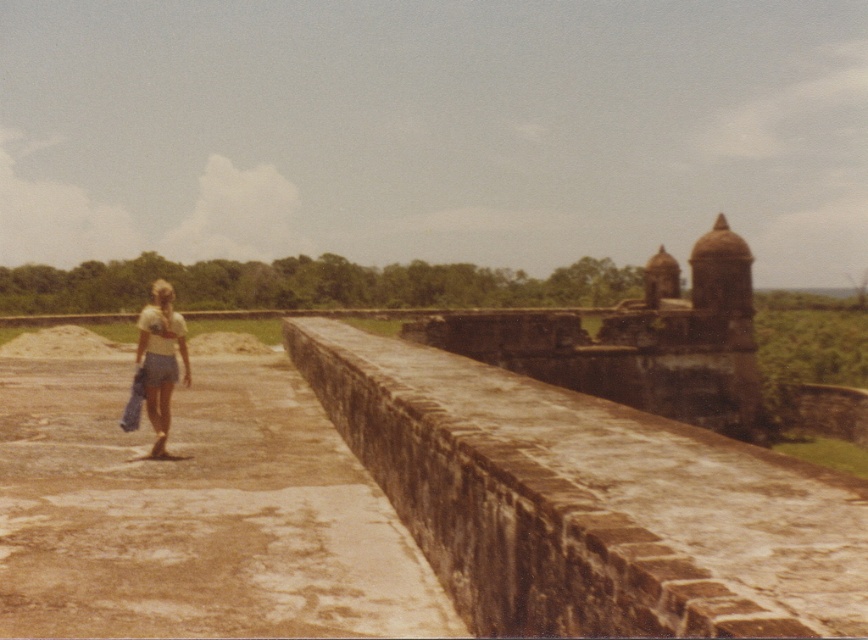
You are standing at the entrance of the historical site and notice a brown stone fort at center and a white cotton shirt at center. Which object is positioned lower in the image?

The brown stone fort at center is located below the white cotton shirt at center, so it is positioned lower in the image.

You are standing at the entrance of the fortress and see the brown stone moat at center and the white cotton shirt at center. Which object is closer to you?

The white cotton shirt at center is closer to you because it is only 20.37 feet away from the brown stone moat at center, but since the shirt is at the same center position, the distance between them indicates the shirt is in front.

You are standing at the viewpoint of the image and want to reach the point marked as point (x=402, y=435). If your walking speed is 3 feet per second, how many seconds will it take you to reach there?

The distance between you and point (x=402, y=435) is 26.67 feet. At a speed of 3 feet per second, it will take approximately 8.89 seconds to reach there.